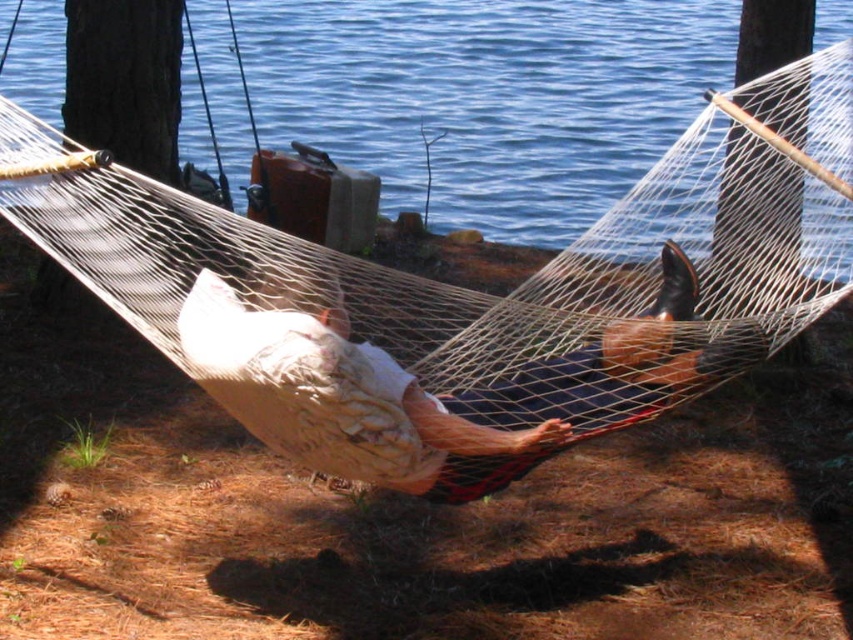
Question: Can you confirm if blue water at center is bigger than white cotton shirt at center?

Choices:
 (A) no
 (B) yes

Answer: (B)

Question: Is blue water at center wider than white cotton shirt at center?

Choices:
 (A) yes
 (B) no

Answer: (A)

Question: Can you confirm if blue water at center is positioned to the right of white cotton shirt at center?

Choices:
 (A) no
 (B) yes

Answer: (B)